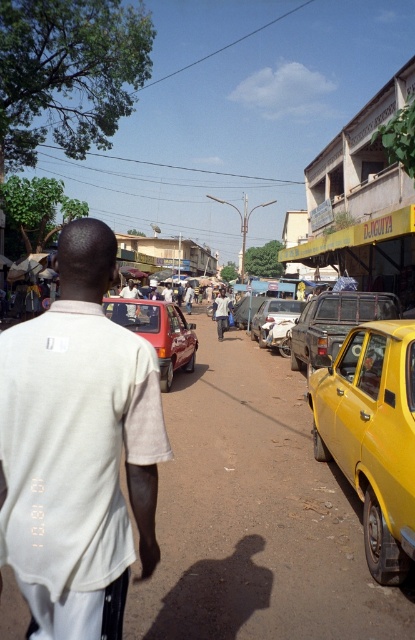
Who is lower down, rusty metal car at center or metallic silver car at center?

rusty metal car at center

Does rusty metal car at center have a greater height compared to metallic silver car at center?

Yes, rusty metal car at center is taller than metallic silver car at center.

Does point (263, 320) lie behind point (244, 301)?

No, it is in front of (244, 301).

Locate an element on the screen. This screenshot has width=415, height=640. rusty metal car at center is located at coordinates (273, 317).

Does point (141, 540) lie in front of point (278, 326)?

Yes.

Does point (49, 332) come in front of point (273, 301)?

That is True.

You are a GUI agent. You are given a task and a screenshot of the screen. Output one action in this format:
    pyautogui.click(x=<x>, y=<y>)
    Task: Click on the white cotton shirt at center
    
    Given the screenshot: What is the action you would take?
    pyautogui.click(x=78, y=449)

Does point (258, 304) lie behind point (134, 308)?

Yes, point (258, 304) is farther from viewer.

Can you confirm if metallic silver car at center is smaller than matte black car at center?

Yes.

Find the location of a particular element. metallic silver car at center is located at coordinates pyautogui.click(x=246, y=308).